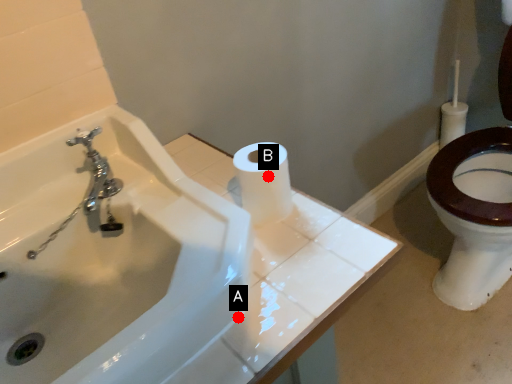
Question: Two points are circled on the image, labeled by A and B beside each circle. Which point is farther to the camera?

Choices:
 (A) A is further
 (B) B is further

Answer: (B)